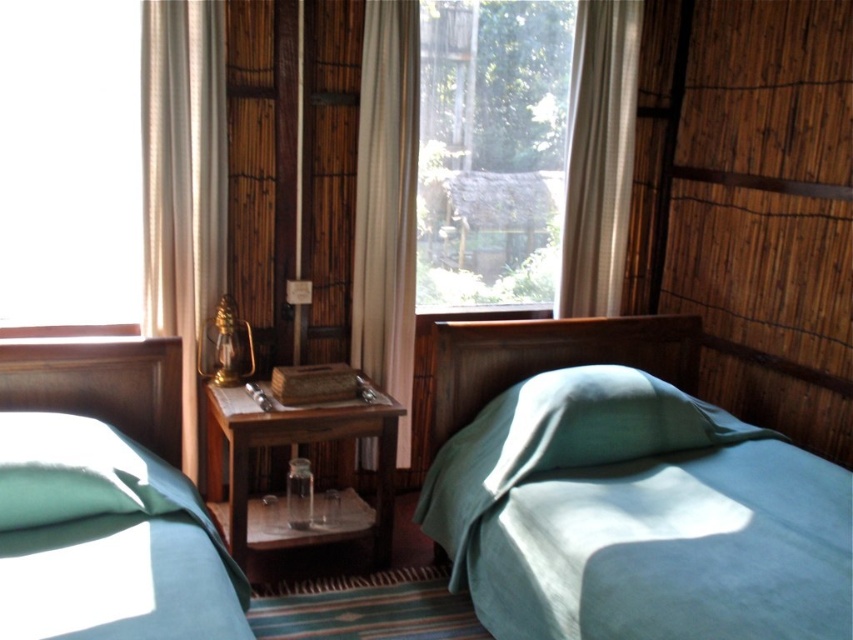
Consider the image. Can you confirm if transparent glass window at upper left is positioned below matte green fabric bed at left?

Actually, transparent glass window at upper left is above matte green fabric bed at left.

Does point (117, 81) lie behind point (160, 486)?

Yes.

Where is `transparent glass window at upper left`? The width and height of the screenshot is (853, 640). transparent glass window at upper left is located at coordinates (68, 161).

Find the location of a particular element. This screenshot has width=853, height=640. matte green fabric bed at center is located at coordinates (624, 492).

Can you confirm if matte green fabric bed at center is taller than matte green fabric bed at left?

Correct, matte green fabric bed at center is much taller as matte green fabric bed at left.

Where is `matte green fabric bed at center`? matte green fabric bed at center is located at coordinates (624, 492).

Who is more forward, (44, 342) or (358, 257)?

Point (44, 342) is more forward.

Is point (238, 609) behind point (396, 392)?

No, (238, 609) is in front of (396, 392).

You are a GUI agent. You are given a task and a screenshot of the screen. Output one action in this format:
    pyautogui.click(x=<x>, y=<y>)
    Task: Click on the matte green fabric bed at left
    
    Given the screenshot: What is the action you would take?
    click(148, 472)